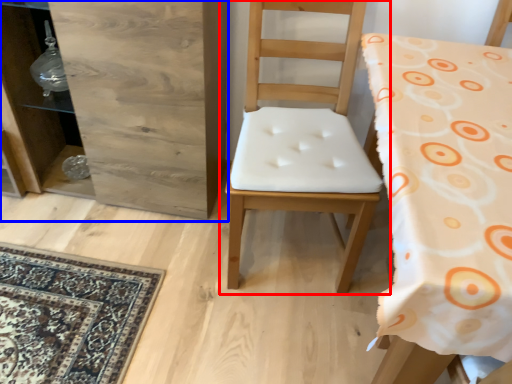
Question: Among these objects, which one is nearest to the camera, chair (highlighted by a red box) or dresser (highlighted by a blue box)?

Choices:
 (A) chair
 (B) dresser

Answer: (A)